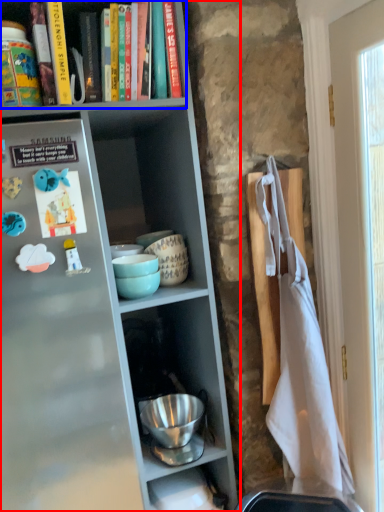
Question: Which point is closer to the camera, shelf (highlighted by a red box) or book (highlighted by a blue box)?

Choices:
 (A) shelf
 (B) book

Answer: (A)